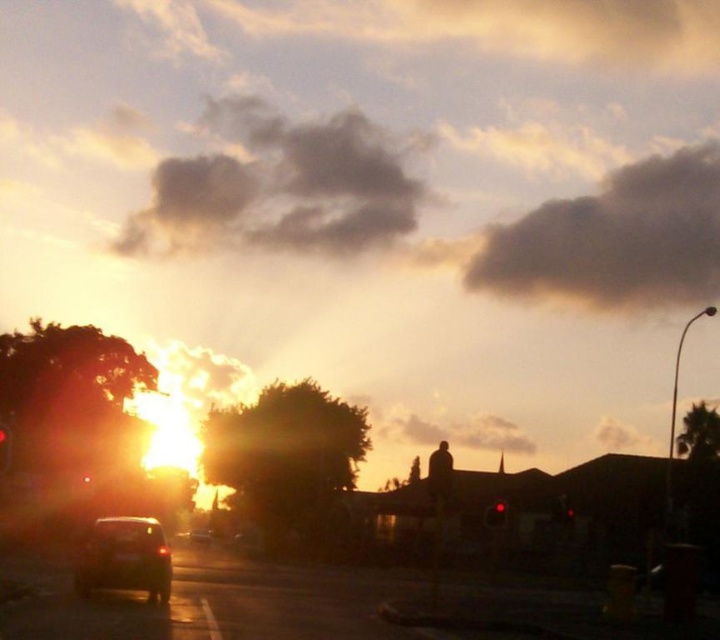
Does fuzzy white cloud at upper center have a smaller size compared to red glass traffic light at center?

Actually, fuzzy white cloud at upper center might be larger than red glass traffic light at center.

Which is more to the left, fuzzy white cloud at upper center or red glass traffic light at center?

Positioned to the left is red glass traffic light at center.

Between point (459, 438) and point (500, 504), which one is positioned behind?

Positioned behind is point (459, 438).

Identify the location of fuzzy white cloud at upper center. This screenshot has width=720, height=640. (459, 433).

Can you confirm if red glass traffic light at center is shorter than shiny silver car at center?

Yes, red glass traffic light at center is shorter than shiny silver car at center.

Can you confirm if red glass traffic light at center is thinner than shiny silver car at center?

Yes.

Is point (486, 518) less distant than point (199, 538)?

Yes, it is in front of point (199, 538).

In order to click on red glass traffic light at center in this screenshot , I will do `click(495, 515)`.

Can you confirm if dark gray cloud at upper right is wider than fuzzy white cloud at upper center?

Yes, dark gray cloud at upper right is wider than fuzzy white cloud at upper center.

Which of these two, dark gray cloud at upper right or fuzzy white cloud at upper center, stands taller?

With more height is dark gray cloud at upper right.

Measure the distance between dark gray cloud at upper right and camera.

dark gray cloud at upper right and camera are 200.10 meters apart from each other.

Locate an element on the screen. dark gray cloud at upper right is located at coordinates (616, 240).